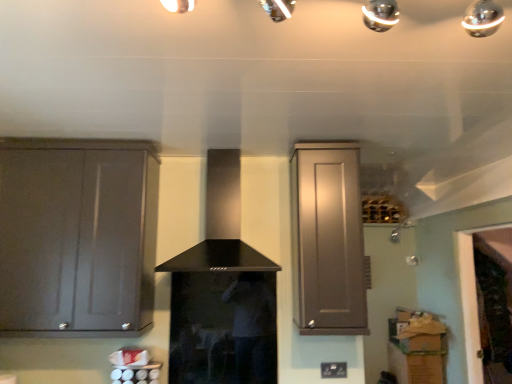
Question: From the image's perspective, does matte gray cabinet at upper right, the first cabinetry positioned from the right, appear lower than black matte vent at center?

Choices:
 (A) yes
 (B) no

Answer: (A)

Question: Is matte gray cabinet at upper right, the first cabinetry positioned from the right, not inside black matte vent at center?

Choices:
 (A) no
 (B) yes

Answer: (B)

Question: Is matte gray cabinet at upper right, the 2th cabinetry when ordered from left to right, bigger than black matte vent at center?

Choices:
 (A) yes
 (B) no

Answer: (B)

Question: Is matte gray cabinet at upper right, the 2th cabinetry when ordered from left to right, thinner than black matte vent at center?

Choices:
 (A) yes
 (B) no

Answer: (A)

Question: Is the position of matte gray cabinet at upper right, the first cabinetry positioned from the right, less distant than that of black matte vent at center?

Choices:
 (A) no
 (B) yes

Answer: (A)

Question: Looking at the image, does black matte vent at center seem bigger or smaller compared to matte gray cabinet at upper right, the 2th cabinetry when ordered from left to right?

Choices:
 (A) big
 (B) small

Answer: (A)

Question: Looking at their shapes, would you say black matte vent at center is wider or thinner than matte gray cabinet at upper right, the 2th cabinetry when ordered from left to right?

Choices:
 (A) wide
 (B) thin

Answer: (A)

Question: From a real-world perspective, is black matte vent at center physically located above or below matte gray cabinet at upper right, the first cabinetry positioned from the right?

Choices:
 (A) below
 (B) above

Answer: (B)

Question: Considering their positions, is black matte vent at center located in front of or behind matte gray cabinet at upper right, the first cabinetry positioned from the right?

Choices:
 (A) behind
 (B) front

Answer: (B)

Question: Is matte gray cabinet at upper right, the 2th cabinetry when ordered from left to right, wider or thinner than matte gray cabinet at left, the second cabinetry positioned from the right?

Choices:
 (A) thin
 (B) wide

Answer: (B)

Question: Is point (301, 246) closer or farther from the camera than point (75, 259)?

Choices:
 (A) closer
 (B) farther

Answer: (B)

Question: Is matte gray cabinet at upper right, the first cabinetry positioned from the right, in front of or behind matte gray cabinet at left, the second cabinetry positioned from the right, in the image?

Choices:
 (A) front
 (B) behind

Answer: (B)

Question: From the image's perspective, is matte gray cabinet at upper right, the first cabinetry positioned from the right, above or below matte gray cabinet at left, the second cabinetry positioned from the right?

Choices:
 (A) below
 (B) above

Answer: (B)

Question: In terms of height, does matte gray cabinet at left, the second cabinetry positioned from the right, look taller or shorter compared to black matte vent at center?

Choices:
 (A) tall
 (B) short

Answer: (A)

Question: From the image's perspective, is matte gray cabinet at left, the second cabinetry positioned from the right, positioned above or below black matte vent at center?

Choices:
 (A) above
 (B) below

Answer: (B)